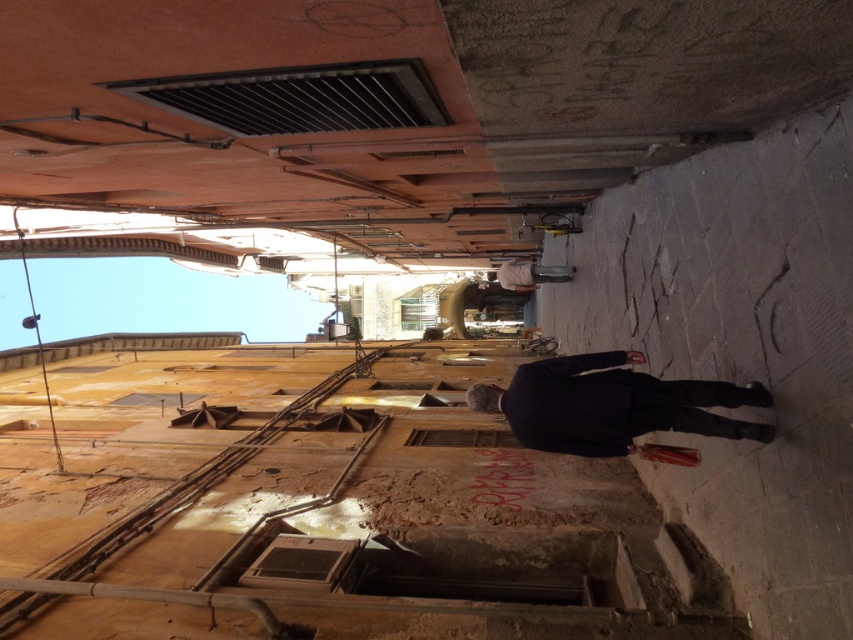
Question: Is rustic stone steps at lower right closer to camera compared to dark blue suit at center?

Choices:
 (A) yes
 (B) no

Answer: (A)

Question: Does rustic stone steps at lower right have a lesser width compared to dark blue suit at center?

Choices:
 (A) yes
 (B) no

Answer: (B)

Question: Which point appears farthest from the camera in this image?

Choices:
 (A) [x=434, y=538]
 (B) [x=556, y=410]

Answer: (A)

Question: Can you confirm if rustic stone steps at lower right is positioned below dark blue suit at center?

Choices:
 (A) yes
 (B) no

Answer: (A)